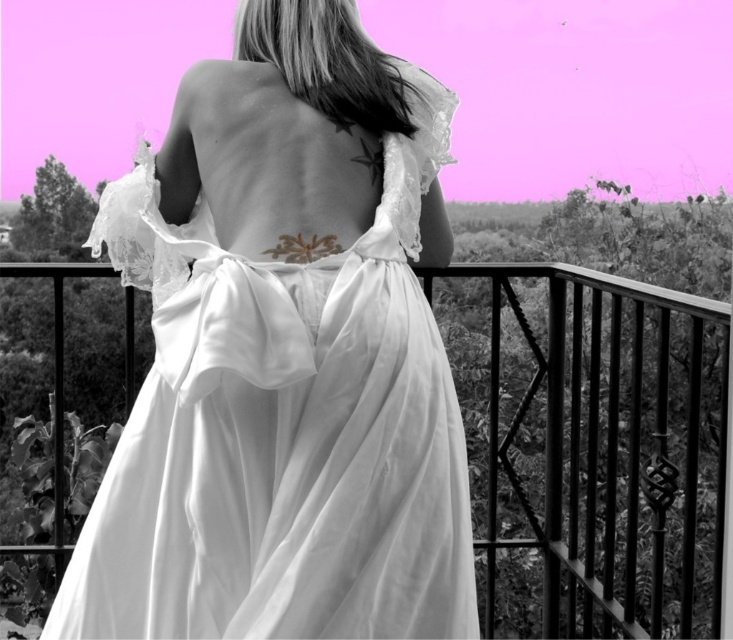
Question: Can you confirm if satin dress at center is positioned to the right of metallic black balcony at center?

Choices:
 (A) no
 (B) yes

Answer: (A)

Question: Among these points, which one is nearest to the camera?

Choices:
 (A) (534, 340)
 (B) (161, 291)

Answer: (B)

Question: Can you confirm if satin dress at center is positioned below metallic black balcony at center?

Choices:
 (A) no
 (B) yes

Answer: (A)

Question: In this image, where is satin dress at center located relative to metallic black balcony at center?

Choices:
 (A) left
 (B) right

Answer: (A)

Question: Among these points, which one is farthest from the camera?

Choices:
 (A) (334, 419)
 (B) (487, 476)

Answer: (B)